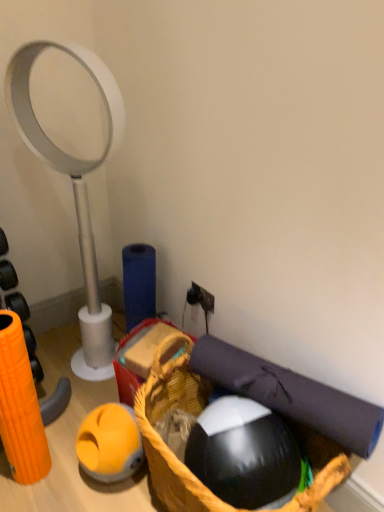
Question: Do you think black rubber ball at lower center is within white plastic magnifying glass at left, or outside of it?

Choices:
 (A) inside
 (B) outside

Answer: (B)

Question: Is black rubber ball at lower center wider or thinner than white plastic magnifying glass at left?

Choices:
 (A) wide
 (B) thin

Answer: (B)

Question: Which of these objects is positioned farthest from the dark blue fabric yoga mat at lower right?

Choices:
 (A) white plastic magnifying glass at left
 (B) woven brown basket at lower center
 (C) black rubber ball at lower center

Answer: (A)

Question: Based on their relative distances, which object is farther from the woven brown basket at lower center?

Choices:
 (A) dark blue fabric yoga mat at lower right
 (B) black rubber ball at lower center
 (C) white plastic magnifying glass at left

Answer: (C)